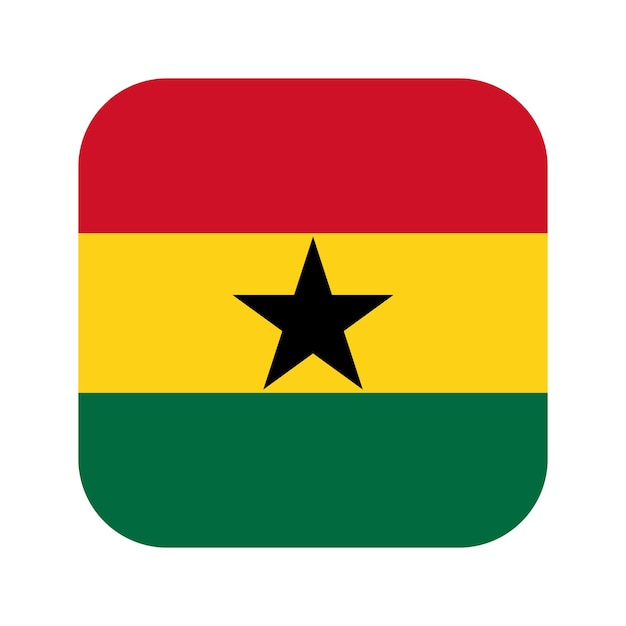
Where is `corner`? The height and width of the screenshot is (626, 626). corner is located at coordinates (580, 208).